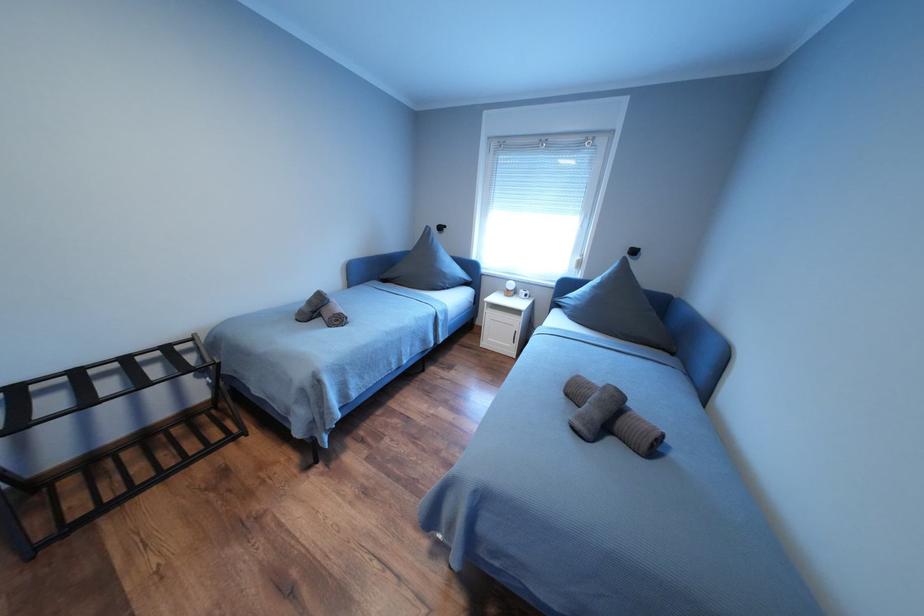
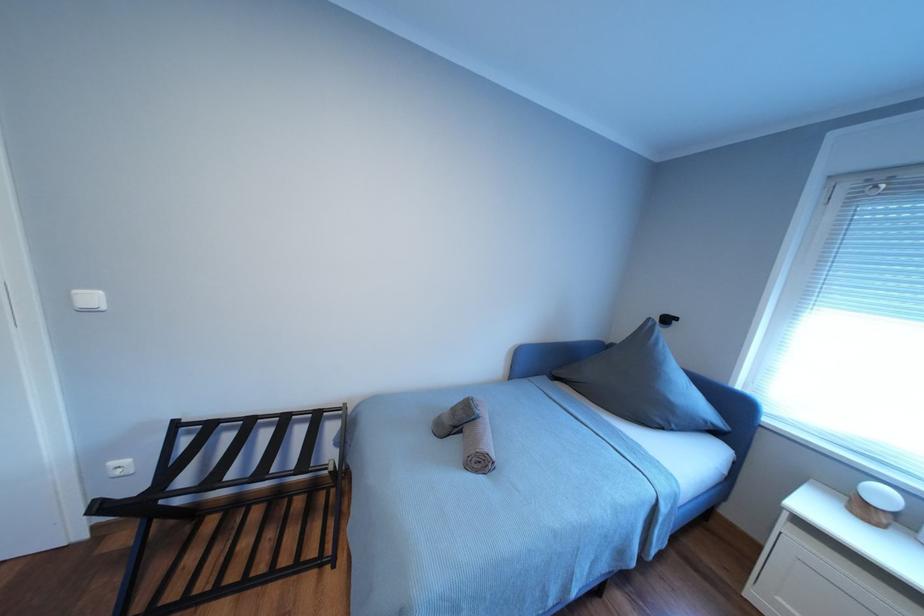
Question: The first image is from the beginning of the video and the second image is from the end. How did the camera likely rotate when shooting the video?

Choices:
 (A) Left
 (B) Right
 (C) Up
 (D) Down

Answer: (A)